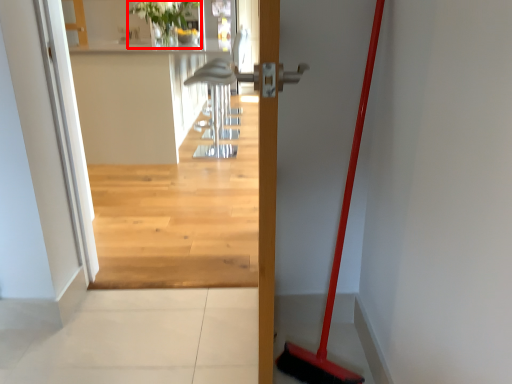
Question: From the image's perspective, considering the relative positions of plant (annotated by the red box) and door in the image provided, where is plant (annotated by the red box) located with respect to the staircase?

Choices:
 (A) below
 (B) above

Answer: (B)